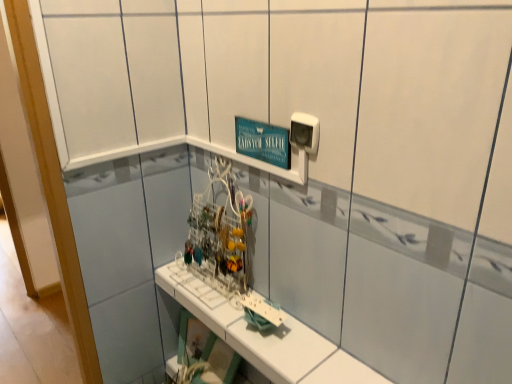
Describe the element at coordinates (305, 132) in the screenshot. I see `white plastic electric outlet at upper right` at that location.

Find the location of `white plastic electric outlet at upper right`. white plastic electric outlet at upper right is located at coordinates (305, 132).

Measure the distance between white plastic electric outlet at upper right and camera.

The distance of white plastic electric outlet at upper right from camera is 35.85 inches.

What do you see at coordinates (269, 339) in the screenshot? This screenshot has width=512, height=384. I see `white plastic shelf at center` at bounding box center [269, 339].

Where is `white plastic shelf at center`? The height and width of the screenshot is (384, 512). white plastic shelf at center is located at coordinates (269, 339).

The image size is (512, 384). Find the location of `white plastic electric outlet at upper right`. white plastic electric outlet at upper right is located at coordinates (305, 132).

Considering the positions of objects white plastic shelf at center and white plastic electric outlet at upper right in the image provided, who is more to the left, white plastic shelf at center or white plastic electric outlet at upper right?

white plastic shelf at center is more to the left.

Is white plastic shelf at center closer to the viewer compared to white plastic electric outlet at upper right?

That is True.

Considering the positions of points (170, 284) and (314, 124), is point (170, 284) closer to camera compared to point (314, 124)?

No, (170, 284) is further to viewer.

From the image's perspective, is white plastic shelf at center beneath white plastic electric outlet at upper right?

Correct, white plastic shelf at center appears lower than white plastic electric outlet at upper right in the image.

From a real-world perspective, is white plastic shelf at center over white plastic electric outlet at upper right?

No.

Looking at this image, is white plastic shelf at center wider or thinner than white plastic electric outlet at upper right?

Clearly, white plastic shelf at center has more width compared to white plastic electric outlet at upper right.

Considering the sizes of white plastic shelf at center and white plastic electric outlet at upper right in the image, is white plastic shelf at center taller or shorter than white plastic electric outlet at upper right?

Considering their sizes, white plastic shelf at center has less height than white plastic electric outlet at upper right.

Who is bigger, white plastic shelf at center or white plastic electric outlet at upper right?

white plastic shelf at center is bigger.

Is white plastic shelf at center not within white plastic electric outlet at upper right?

Indeed, white plastic shelf at center is completely outside white plastic electric outlet at upper right.

Are white plastic shelf at center and white plastic electric outlet at upper right far apart?

Actually, white plastic shelf at center and white plastic electric outlet at upper right are a little close together.

Based on the photo, is white plastic shelf at center turned away from white plastic electric outlet at upper right?

No, white plastic shelf at center is not facing away from white plastic electric outlet at upper right.

In the scene shown: How different are the orientations of white plastic shelf at center and white plastic electric outlet at upper right in degrees?

The angle between the facing direction of white plastic shelf at center and the facing direction of white plastic electric outlet at upper right is 0.953 degrees.

How distant is white plastic shelf at center from white plastic electric outlet at upper right?

A distance of 20.84 inches exists between white plastic shelf at center and white plastic electric outlet at upper right.

I want to click on electric outlet above the white plastic shelf at center (from a real-world perspective), so click(305, 132).

Does white plastic electric outlet at upper right appear on the right side of white plastic shelf at center?

Indeed, white plastic electric outlet at upper right is positioned on the right side of white plastic shelf at center.

Which object is further away from the camera, white plastic electric outlet at upper right or white plastic shelf at center?

white plastic electric outlet at upper right is further from the camera.

Does point (294, 142) lie in front of point (362, 373)?

No, it is behind (362, 373).

From the image's perspective, is white plastic electric outlet at upper right above or below white plastic shelf at center?

Clearly, from the image's perspective, white plastic electric outlet at upper right is above white plastic shelf at center.

In the scene shown: From a real-world perspective, is white plastic electric outlet at upper right positioned under white plastic shelf at center based on gravity?

No, from a real-world perspective, white plastic electric outlet at upper right is not under white plastic shelf at center.

Between white plastic electric outlet at upper right and white plastic shelf at center, which one has smaller width?

With smaller width is white plastic electric outlet at upper right.

Who is shorter, white plastic electric outlet at upper right or white plastic shelf at center?

white plastic shelf at center is shorter.

Can you confirm if white plastic electric outlet at upper right is bigger than white plastic shelf at center?

Incorrect, white plastic electric outlet at upper right is not larger than white plastic shelf at center.

Is white plastic electric outlet at upper right not within white plastic shelf at center?

Yes, white plastic electric outlet at upper right is not within white plastic shelf at center.

Is white plastic electric outlet at upper right with white plastic shelf at center?

white plastic electric outlet at upper right is not next to white plastic shelf at center, and they're not touching.

Is white plastic electric outlet at upper right oriented towards white plastic shelf at center?

No, white plastic electric outlet at upper right is not turned towards white plastic shelf at center.

What are the coordinates of `electric outlet that is above the white plastic shelf at center (from the image's perspective)` in the screenshot? It's located at (305, 132).

You are a GUI agent. You are given a task and a screenshot of the screen. Output one action in this format:
    pyautogui.click(x=<x>, y=<y>)
    Task: Click on the electric outlet above the white plastic shelf at center (from a real-world perspective)
    The height and width of the screenshot is (384, 512).
    Given the screenshot: What is the action you would take?
    pyautogui.click(x=305, y=132)

Where is `electric outlet lying above the white plastic shelf at center (from the image's perspective)`? The image size is (512, 384). electric outlet lying above the white plastic shelf at center (from the image's perspective) is located at coordinates (305, 132).